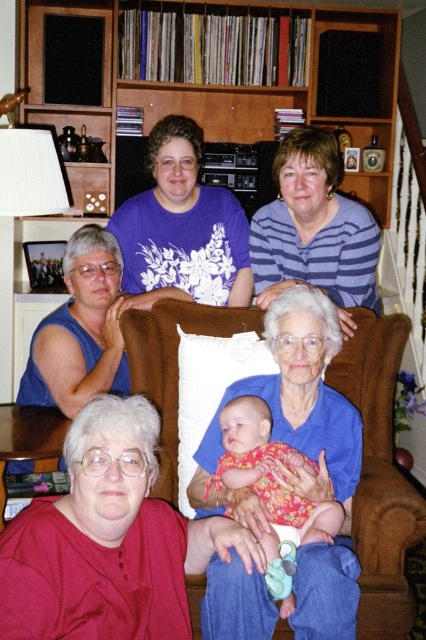
You are standing in the living room and want to place a small plant between the two points marked as point (86, 452) and point (287, 172). Since you want the plant to be closer to the camera, which point should you position it near?

The point closer to the camera is point (86, 452), so the plant should be placed near that point to ensure it is closer to the camera.

You are a delivery person who needs to place a small package between the blue fabric at center and the person wearing a red shirt. Can you fit the package in that space?

The distance between the blue fabric at center and the person wearing a red shirt is 1.44 meters, so yes, the package can be placed there as the space is sufficient.

You are a photographer standing in the living room. You need to take a photo of the matte red blouse at lower left and the blue striped shirt at upper center. Which one is positioned lower in the frame?

The matte red blouse at lower left is positioned lower in the frame than the blue striped shirt at upper center.